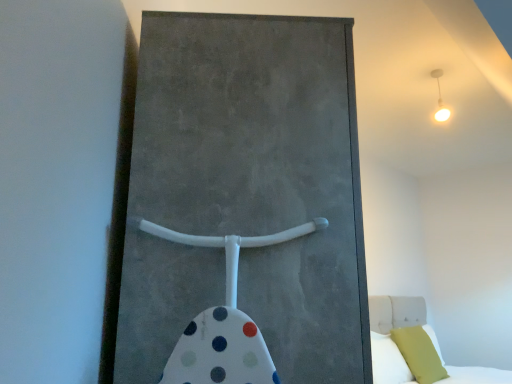
Describe the element at coordinates (388, 361) in the screenshot. The height and width of the screenshot is (384, 512). I see `green fabric pillow at lower right, which is the 1th pillow in left-to-right order` at that location.

Locate an element on the screen. The height and width of the screenshot is (384, 512). white fabric bed at lower right is located at coordinates (400, 351).

This screenshot has height=384, width=512. What do you see at coordinates (400, 351) in the screenshot?
I see `white fabric bed at lower right` at bounding box center [400, 351].

What do you see at coordinates (440, 98) in the screenshot? The image size is (512, 384). I see `white glossy light fixture at upper right` at bounding box center [440, 98].

Find the location of `matte yellow pillow at lower right, which ranks as the second pillow in left-to-right order`. matte yellow pillow at lower right, which ranks as the second pillow in left-to-right order is located at coordinates (419, 354).

The width and height of the screenshot is (512, 384). Find the location of `pillow that is on the left side of matte yellow pillow at lower right, which is the 1th pillow from right to left`. pillow that is on the left side of matte yellow pillow at lower right, which is the 1th pillow from right to left is located at coordinates (388, 361).

Are matte yellow pillow at lower right, which ranks as the second pillow in left-to-right order, and green fabric pillow at lower right, which is the 2th pillow in right-to-left order, far apart?

No, matte yellow pillow at lower right, which ranks as the second pillow in left-to-right order, is not far from green fabric pillow at lower right, which is the 2th pillow in right-to-left order.

Is point (444, 375) behind point (378, 340)?

Yes, point (444, 375) is farther from viewer.

Can you confirm if matte yellow pillow at lower right, which is the 1th pillow from right to left, is thinner than green fabric pillow at lower right, which is the 1th pillow in left-to-right order?

No, matte yellow pillow at lower right, which is the 1th pillow from right to left, is not thinner than green fabric pillow at lower right, which is the 1th pillow in left-to-right order.

Looking at this image, is white glossy light fixture at upper right aimed at concrete textured barn door at center?

No, white glossy light fixture at upper right is not aimed at concrete textured barn door at center.

Considering the positions of objects white glossy light fixture at upper right and concrete textured barn door at center in the image provided, who is in front, white glossy light fixture at upper right or concrete textured barn door at center?

concrete textured barn door at center is more forward.

You are a GUI agent. You are given a task and a screenshot of the screen. Output one action in this format:
    pyautogui.click(x=<x>, y=<y>)
    Task: Click on the barn door that is in front of the white glossy light fixture at upper right
    The width and height of the screenshot is (512, 384).
    Given the screenshot: What is the action you would take?
    pos(262,171)

Choose the correct answer: Is white glossy light fixture at upper right inside concrete textured barn door at center or outside it?

white glossy light fixture at upper right exists outside the volume of concrete textured barn door at center.

Who is more distant, white fabric bed at lower right or concrete textured barn door at center?

white fabric bed at lower right is further away from the camera.

Based on the photo, considering the relative positions of white fabric bed at lower right and concrete textured barn door at center in the image provided, is white fabric bed at lower right to the left or to the right of concrete textured barn door at center?

white fabric bed at lower right is to the right of concrete textured barn door at center.

Considering the sizes of objects white fabric bed at lower right and concrete textured barn door at center in the image provided, who is shorter, white fabric bed at lower right or concrete textured barn door at center?

white fabric bed at lower right.

How different are the orientations of white fabric bed at lower right and concrete textured barn door at center in degrees?

The angle between the facing direction of white fabric bed at lower right and the facing direction of concrete textured barn door at center is 45.3 degrees.

Does concrete textured barn door at center lie behind white fabric bed at lower right?

No, it is in front of white fabric bed at lower right.

From a real-world perspective, is concrete textured barn door at center positioned over white fabric bed at lower right based on gravity?

Yes.

In the scene shown: Are concrete textured barn door at center and white fabric bed at lower right making contact?

concrete textured barn door at center and white fabric bed at lower right are clearly separated.

Which of these two, concrete textured barn door at center or white fabric bed at lower right, is thinner?

concrete textured barn door at center.

Could you measure the distance between white fabric bed at lower right and matte yellow pillow at lower right, which ranks as the second pillow in left-to-right order?

The distance of white fabric bed at lower right from matte yellow pillow at lower right, which ranks as the second pillow in left-to-right order, is 8.82 inches.

Which is in front, white fabric bed at lower right or matte yellow pillow at lower right, which is the 1th pillow from right to left?

white fabric bed at lower right is more forward.

From the image's perspective, who appears lower, white fabric bed at lower right or matte yellow pillow at lower right, which is the 1th pillow from right to left?

matte yellow pillow at lower right, which is the 1th pillow from right to left.

From a real-world perspective, is white fabric bed at lower right physically located above or below matte yellow pillow at lower right, which ranks as the second pillow in left-to-right order?

white fabric bed at lower right is above matte yellow pillow at lower right, which ranks as the second pillow in left-to-right order.

From a real-world perspective, is matte yellow pillow at lower right, which is the 1th pillow from right to left, positioned over white glossy light fixture at upper right based on gravity?

Incorrect, from a real-world perspective, matte yellow pillow at lower right, which is the 1th pillow from right to left, is lower than white glossy light fixture at upper right.

From the image's perspective, is matte yellow pillow at lower right, which is the 1th pillow from right to left, above white glossy light fixture at upper right?

No.

Is matte yellow pillow at lower right, which is the 1th pillow from right to left, taller or shorter than white glossy light fixture at upper right?

Considering their sizes, matte yellow pillow at lower right, which is the 1th pillow from right to left, has more height than white glossy light fixture at upper right.

Choose the correct answer: Is matte yellow pillow at lower right, which ranks as the second pillow in left-to-right order, inside white glossy light fixture at upper right or outside it?

matte yellow pillow at lower right, which ranks as the second pillow in left-to-right order, lies outside white glossy light fixture at upper right.

Does point (434, 75) come farther from viewer compared to point (374, 349)?

No, (434, 75) is in front of (374, 349).

Can you confirm if white glossy light fixture at upper right is smaller than green fabric pillow at lower right, which is the 1th pillow in left-to-right order?

Yes.

Identify the location of light fixture above the green fabric pillow at lower right, which is the 2th pillow in right-to-left order (from the image's perspective). The width and height of the screenshot is (512, 384). (440, 98).

In the image, there is a green fabric pillow at lower right, which is the 2th pillow in right-to-left order. Where is `pillow below it (from a real-world perspective)`? pillow below it (from a real-world perspective) is located at coordinates (419, 354).

Locate an element on the screen. This screenshot has width=512, height=384. light fixture on the right of concrete textured barn door at center is located at coordinates (440, 98).

Considering their positions, is concrete textured barn door at center positioned closer to white fabric bed at lower right than matte yellow pillow at lower right, which is the 1th pillow from right to left?

matte yellow pillow at lower right, which is the 1th pillow from right to left.

Based on their spatial positions, is white fabric bed at lower right or white glossy light fixture at upper right further from green fabric pillow at lower right, which is the 1th pillow in left-to-right order?

white glossy light fixture at upper right.

Looking at the image, which one is located further to white glossy light fixture at upper right, green fabric pillow at lower right, which is the 1th pillow in left-to-right order, or concrete textured barn door at center?

The object further to white glossy light fixture at upper right is concrete textured barn door at center.

Estimate the real-world distances between objects in this image. Which object is closer to matte yellow pillow at lower right, which is the 1th pillow from right to left, concrete textured barn door at center or white glossy light fixture at upper right?

The object closer to matte yellow pillow at lower right, which is the 1th pillow from right to left, is white glossy light fixture at upper right.

Which object lies further to the anchor point green fabric pillow at lower right, which is the 2th pillow in right-to-left order, matte yellow pillow at lower right, which is the 1th pillow from right to left, or concrete textured barn door at center?

concrete textured barn door at center lies further to green fabric pillow at lower right, which is the 2th pillow in right-to-left order, than the other object.

From the image, which object appears to be nearer to white glossy light fixture at upper right, white fabric bed at lower right or green fabric pillow at lower right, which is the 1th pillow in left-to-right order?

Among the two, white fabric bed at lower right is located nearer to white glossy light fixture at upper right.

Estimate the real-world distances between objects in this image. Which object is further from concrete textured barn door at center, white glossy light fixture at upper right or matte yellow pillow at lower right, which is the 1th pillow from right to left?

matte yellow pillow at lower right, which is the 1th pillow from right to left, lies further to concrete textured barn door at center than the other object.

Based on their spatial positions, is concrete textured barn door at center or green fabric pillow at lower right, which is the 2th pillow in right-to-left order, further from matte yellow pillow at lower right, which ranks as the second pillow in left-to-right order?

The object further to matte yellow pillow at lower right, which ranks as the second pillow in left-to-right order, is concrete textured barn door at center.

Locate an element on the screen. This screenshot has height=384, width=512. bed between white glossy light fixture at upper right and matte yellow pillow at lower right, which ranks as the second pillow in left-to-right order, from top to bottom is located at coordinates (400, 351).

Identify the location of light fixture between concrete textured barn door at center and green fabric pillow at lower right, which is the 2th pillow in right-to-left order, in the front-back direction. The image size is (512, 384). (440, 98).

Image resolution: width=512 pixels, height=384 pixels. What are the coordinates of `pillow between white glossy light fixture at upper right and matte yellow pillow at lower right, which is the 1th pillow from right to left, from top to bottom` in the screenshot? It's located at (388, 361).

At what (x,y) coordinates should I click in order to perform the action: click on pillow between concrete textured barn door at center and matte yellow pillow at lower right, which ranks as the second pillow in left-to-right order, along the z-axis. Please return your answer as a coordinate pair (x, y). Image resolution: width=512 pixels, height=384 pixels. Looking at the image, I should click on (388, 361).